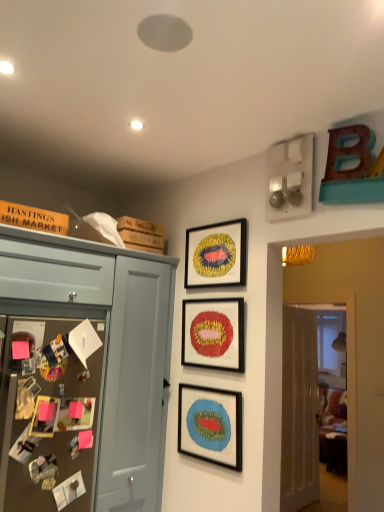
Question: Is white glossy door at right closer to the viewer compared to matte red picture frame at center, which appears as the second picture frame when ordered from the bottom?

Choices:
 (A) no
 (B) yes

Answer: (A)

Question: From a real-world perspective, is white glossy door at right over matte red picture frame at center, which appears as the second picture frame when ordered from the bottom?

Choices:
 (A) yes
 (B) no

Answer: (B)

Question: Would you say white glossy door at right contains matte red picture frame at center, which appears as the second picture frame when ordered from the bottom?

Choices:
 (A) no
 (B) yes

Answer: (A)

Question: From a real-world perspective, is white glossy door at right under matte red picture frame at center, the 2th picture frame when ordered from top to bottom?

Choices:
 (A) yes
 (B) no

Answer: (A)

Question: Does white glossy door at right appear on the right side of matte red picture frame at center, which appears as the second picture frame when ordered from the bottom?

Choices:
 (A) no
 (B) yes

Answer: (B)

Question: Based on their positions, is brown textured bulletin board at left located to the left or right of matte blue cabinet at left?

Choices:
 (A) right
 (B) left

Answer: (B)

Question: Considering the positions of brown textured bulletin board at left and matte blue cabinet at left in the image, is brown textured bulletin board at left bigger or smaller than matte blue cabinet at left?

Choices:
 (A) big
 (B) small

Answer: (B)

Question: From a real-world perspective, is brown textured bulletin board at left above or below matte blue cabinet at left?

Choices:
 (A) above
 (B) below

Answer: (B)

Question: Is point (69, 457) positioned closer to the camera than point (94, 317)?

Choices:
 (A) closer
 (B) farther

Answer: (A)

Question: Considering the positions of point (51, 489) and point (89, 461), is point (51, 489) closer or farther from the camera than point (89, 461)?

Choices:
 (A) farther
 (B) closer

Answer: (B)

Question: Is matte blue cabinet at left taller or shorter than brown textured bulletin board at left?

Choices:
 (A) tall
 (B) short

Answer: (A)

Question: From the image's perspective, is matte blue cabinet at left located above or below brown textured bulletin board at left?

Choices:
 (A) above
 (B) below

Answer: (B)

Question: Considering the positions of matte blue cabinet at left and brown textured bulletin board at left in the image, is matte blue cabinet at left bigger or smaller than brown textured bulletin board at left?

Choices:
 (A) big
 (B) small

Answer: (A)

Question: Does point (196, 396) appear closer or farther from the camera than point (74, 254)?

Choices:
 (A) closer
 (B) farther

Answer: (B)

Question: Is matte black picture frame at center, the third picture frame viewed from the top, inside the boundaries of matte blue cabinet at left, or outside?

Choices:
 (A) outside
 (B) inside

Answer: (A)